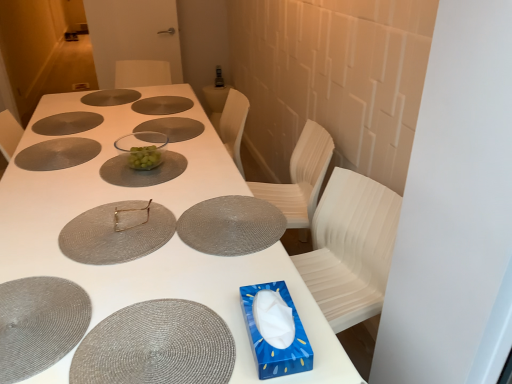
This screenshot has width=512, height=384. Identify the location of free spot below matte gray placemat at center, placed as the third glass plate when sorted from front to back (from a real-world perspective). (227, 220).